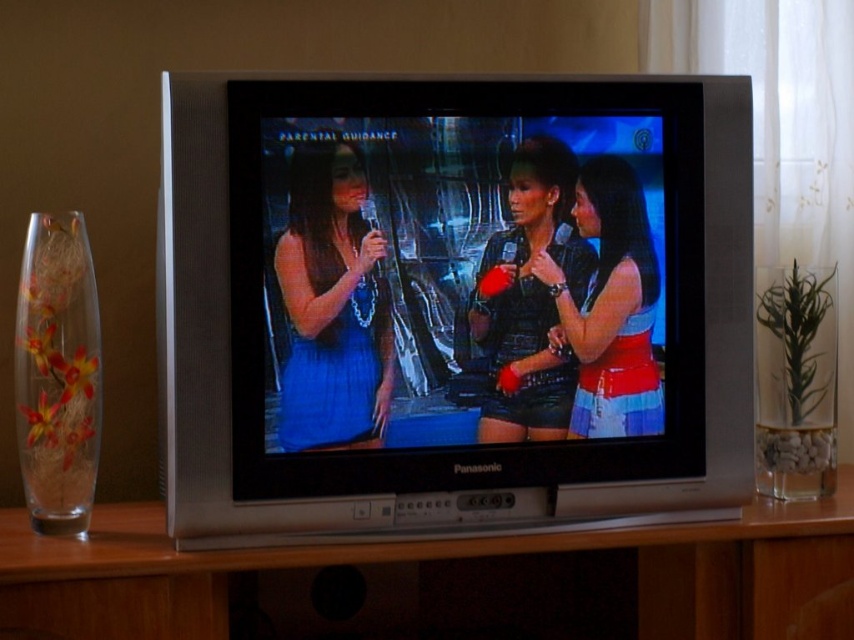
Is point (550, 374) farther from camera compared to point (530, 262)?

Yes, it is.

Is shiny black dress at center thinner than shiny red fabric top at center?

Yes, shiny black dress at center is thinner than shiny red fabric top at center.

Between point (535, 205) and point (542, 259), which one is positioned in front?

Point (535, 205) is in front.

Identify the location of shiny black dress at center. (x=529, y=298).

Is point (455, 104) positioned behind point (79, 508)?

That is False.

From the picture: Does silver metallic flat screen tv at center appear on the left side of translucent glass vase at left?

Incorrect, silver metallic flat screen tv at center is not on the left side of translucent glass vase at left.

I want to click on silver metallic flat screen tv at center, so click(x=454, y=301).

Between silver metallic entertainment center at center and shiny black dress at center, which one appears on the left side from the viewer's perspective?

From the viewer's perspective, silver metallic entertainment center at center appears more on the left side.

Which of these two, silver metallic entertainment center at center or shiny black dress at center, stands taller?

Standing taller between the two is shiny black dress at center.

Does point (420, 582) come behind point (495, 337)?

Yes, it is behind point (495, 337).

Identify the location of silver metallic entertainment center at center. (443, 580).